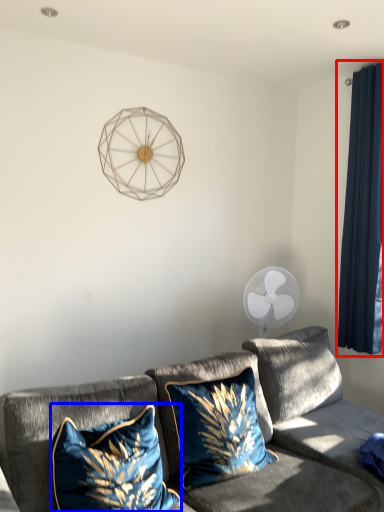
Question: Which object is further to the camera taking this photo, curtain (highlighted by a red box) or pillow (highlighted by a blue box)?

Choices:
 (A) curtain
 (B) pillow

Answer: (A)